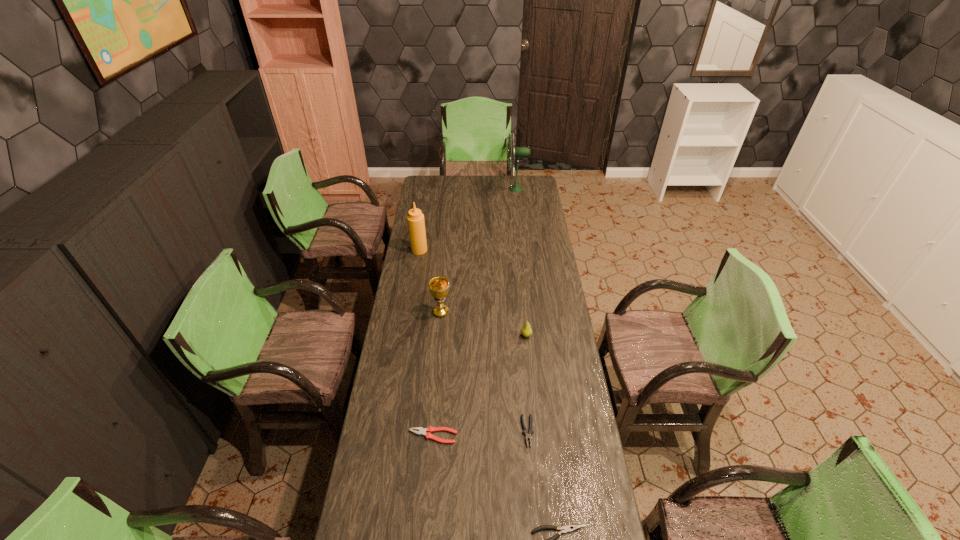
The width and height of the screenshot is (960, 540). What are the coordinates of `the farthest object` in the screenshot? It's located at (518, 152).

Find the location of a particular element. This screenshot has width=960, height=540. fan is located at coordinates (518, 152).

This screenshot has width=960, height=540. What are the coordinates of `the leftmost object` in the screenshot? It's located at (416, 225).

Locate an element on the screen. Image resolution: width=960 pixels, height=540 pixels. condiment is located at coordinates (416, 225).

Locate an element on the screen. the fifth nearest object is located at coordinates (439, 286).

Locate an element on the screen. This screenshot has height=540, width=960. the third tallest object is located at coordinates (439, 286).

Image resolution: width=960 pixels, height=540 pixels. Identify the location of pear. [x=526, y=331].

Locate an element on the screen. the fourth tallest object is located at coordinates (526, 331).

This screenshot has width=960, height=540. What are the coordinates of `the leftmost pliers` in the screenshot? It's located at (422, 431).

Identify the location of vacant space situated 0.310m on the front-facing side of the farthest object. The image size is (960, 540). (456, 188).